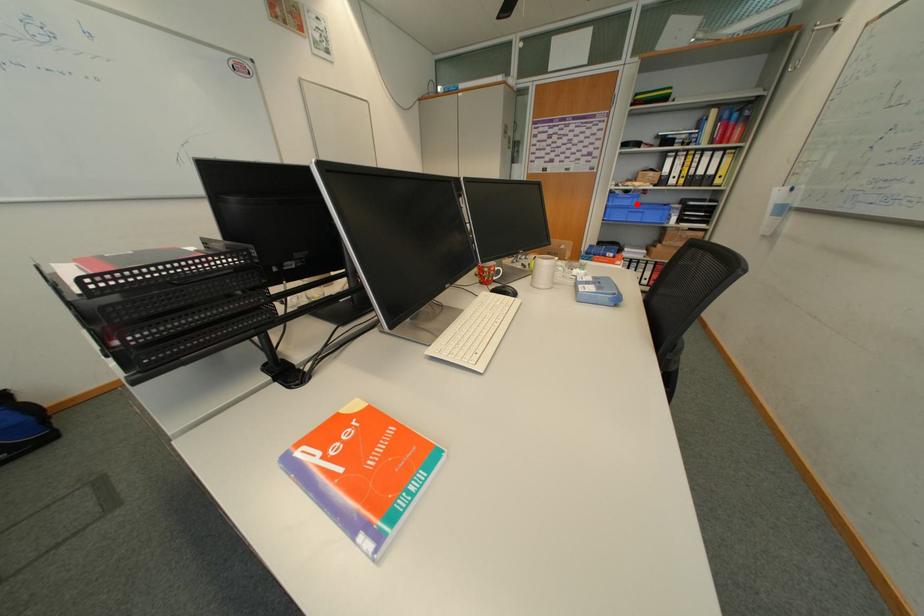
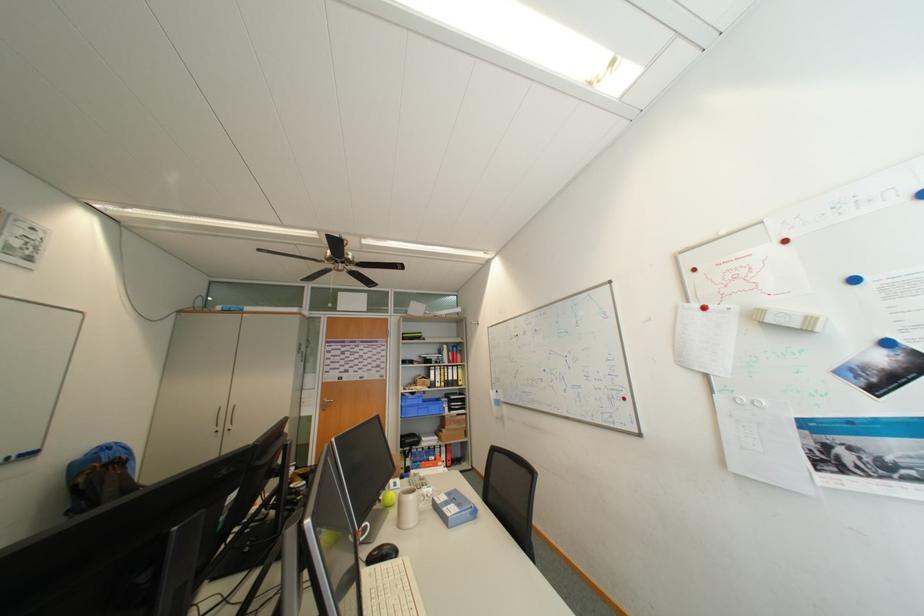
Question: I am providing you with two images of the same scene from different viewpoints. Image1 has a red point marked. In image2, the corresponding 3D location appears at what relative position? Reply with the corresponding letter.

Choices:
 (A) Closer
 (B) Farther

Answer: (B)